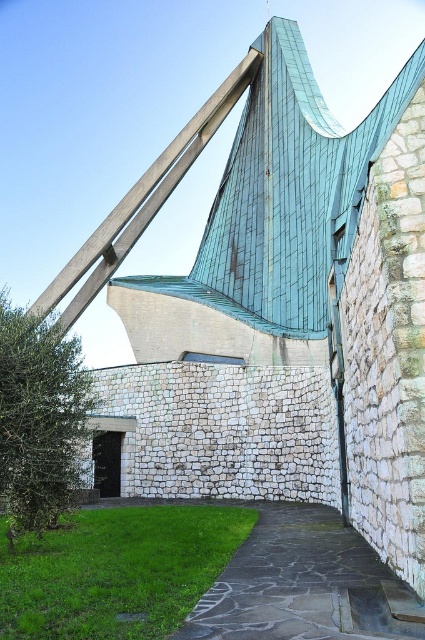
You are standing at the entrance of the modern architectural structure and want to find the paved stone path at lower center. According to the coordinates provided, where should you look to find it?

The paved stone path at lower center is located at the coordinates point (291, 580), so you should look towards the lower center area of the image to find it.

You are a landscape architect evaluating the site. You need to determine if the green grass at lower left can be mowed without hitting the green patina metal beam at upper center. Can you confirm if the grass is shorter than the beam?

The green grass at lower left has a lesser height compared to the green patina metal beam at upper center, so yes, the grass is shorter and can be safely mowed without hitting the beam.

You are standing at point (116,570) in the image and want to walk towards the green copper roof. Which direction should you move to reach it?

The point (116,570) is located at the green grass at lower left, so to reach the green copper roof, you should move towards the upper right direction from the green grass at lower left.